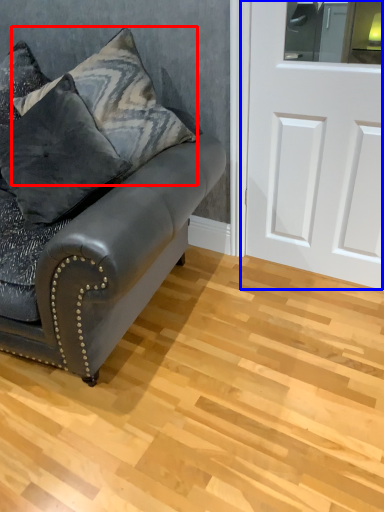
Question: Which point is further to the camera, pillow (highlighted by a red box) or door (highlighted by a blue box)?

Choices:
 (A) pillow
 (B) door

Answer: (A)